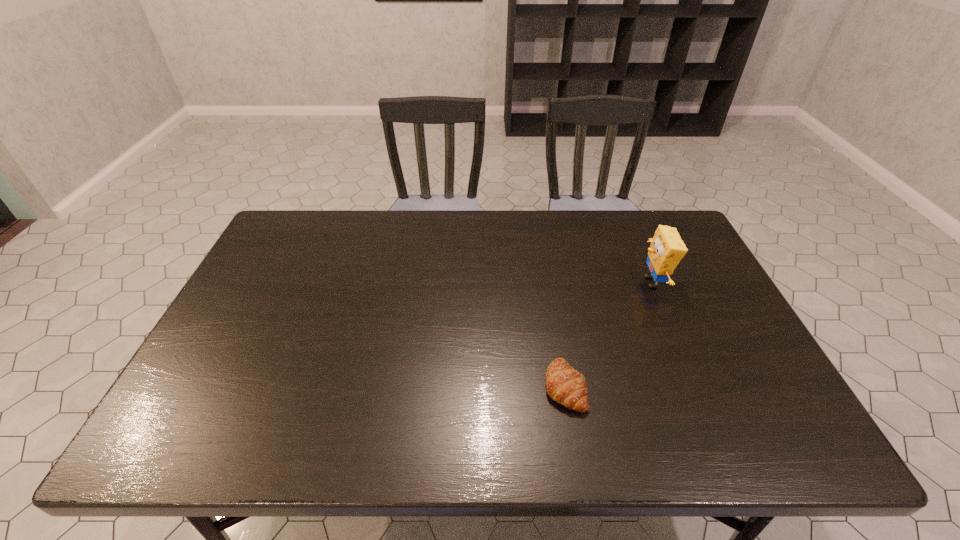
Identify the location of the right object. (667, 249).

The height and width of the screenshot is (540, 960). What are the coordinates of `the farther object` in the screenshot? It's located at (667, 249).

Locate an element on the screen. crescent roll is located at coordinates (565, 385).

Where is `the nearer object`? This screenshot has width=960, height=540. the nearer object is located at coordinates (565, 385).

This screenshot has height=540, width=960. What are the coordinates of `vacant space located on the face of the taller object` in the screenshot? It's located at (533, 282).

Where is `vacant space located 0.110m on the face of the taller object`? This screenshot has width=960, height=540. vacant space located 0.110m on the face of the taller object is located at coordinates (600, 282).

Find the location of `free space located 0.130m on the face of the taller object`. free space located 0.130m on the face of the taller object is located at coordinates (593, 282).

Where is `free space located on the back of the shorter object`? Image resolution: width=960 pixels, height=540 pixels. free space located on the back of the shorter object is located at coordinates (550, 303).

Find the location of `object situated at the right edge`. object situated at the right edge is located at coordinates (667, 249).

In order to click on vacant area at the far edge of the desktop in this screenshot , I will do coord(564,231).